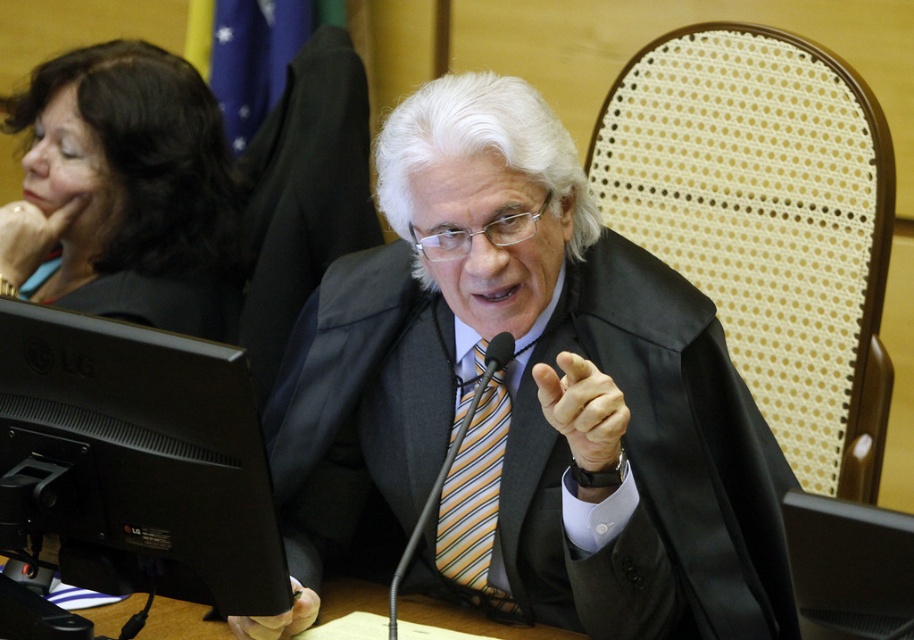
Question: Which of these objects is positioned closest to the gold metallic ring at upper left?

Choices:
 (A) yellow striped tie at center
 (B) black matte monitor at lower left
 (C) smooth skin hand at center
 (D) matte black robe at center

Answer: (B)

Question: Is matte black robe at center thinner than smooth skin hand at center?

Choices:
 (A) no
 (B) yes

Answer: (A)

Question: Which point appears closest to the camera in this image?

Choices:
 (A) pos(115,61)
 (B) pos(745,524)

Answer: (B)

Question: Among these points, which one is farthest from the camera?

Choices:
 (A) (32, 256)
 (B) (279, 628)
 (C) (579, 440)
 (D) (463, 497)

Answer: (A)

Question: Is gold metallic ring at upper left behind matte black hand at lower center?

Choices:
 (A) no
 (B) yes

Answer: (B)

Question: Can you confirm if yellow striped tie at center is smaller than matte black hand at lower center?

Choices:
 (A) yes
 (B) no

Answer: (B)